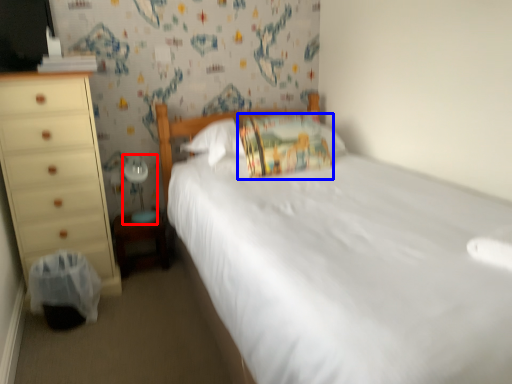
Question: Among these objects, which one is nearest to the camera, table lamp (highlighted by a red box) or pillow (highlighted by a blue box)?

Choices:
 (A) table lamp
 (B) pillow

Answer: (B)